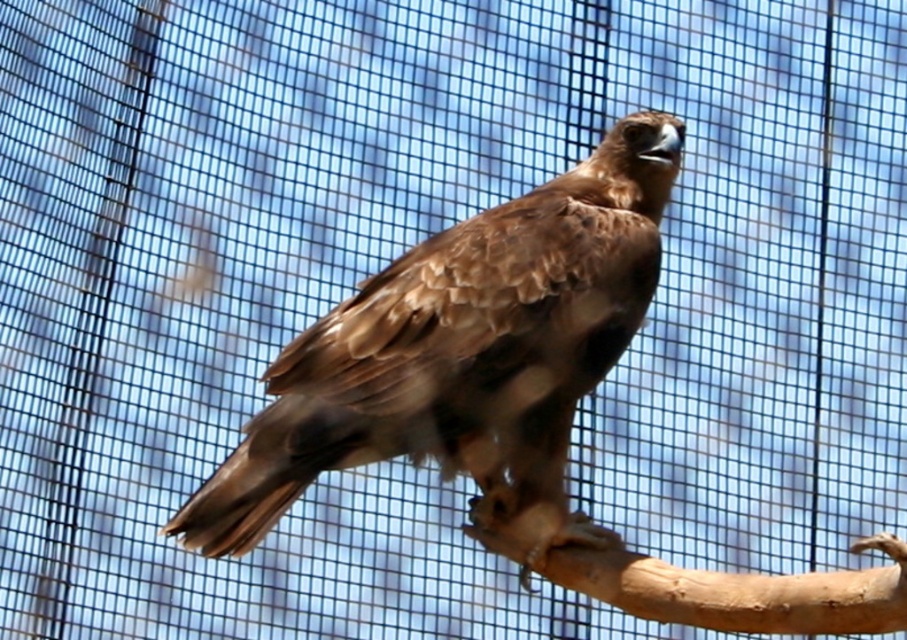
Question: In this image, where is brown feathered eagle at center located relative to smooth brown wood at lower center?

Choices:
 (A) above
 (B) below

Answer: (A)

Question: Is brown feathered eagle at center positioned behind smooth brown wood at lower center?

Choices:
 (A) no
 (B) yes

Answer: (B)

Question: Does brown feathered eagle at center lie behind smooth brown wood at lower center?

Choices:
 (A) yes
 (B) no

Answer: (A)

Question: Among these points, which one is nearest to the camera?

Choices:
 (A) (425, 305)
 (B) (524, 534)

Answer: (A)

Question: Which of the following is the closest to the observer?

Choices:
 (A) smooth brown wood at lower center
 (B) brown feathered eagle at center

Answer: (A)

Question: Which point is farther to the camera?

Choices:
 (A) (532, 477)
 (B) (623, 609)

Answer: (A)